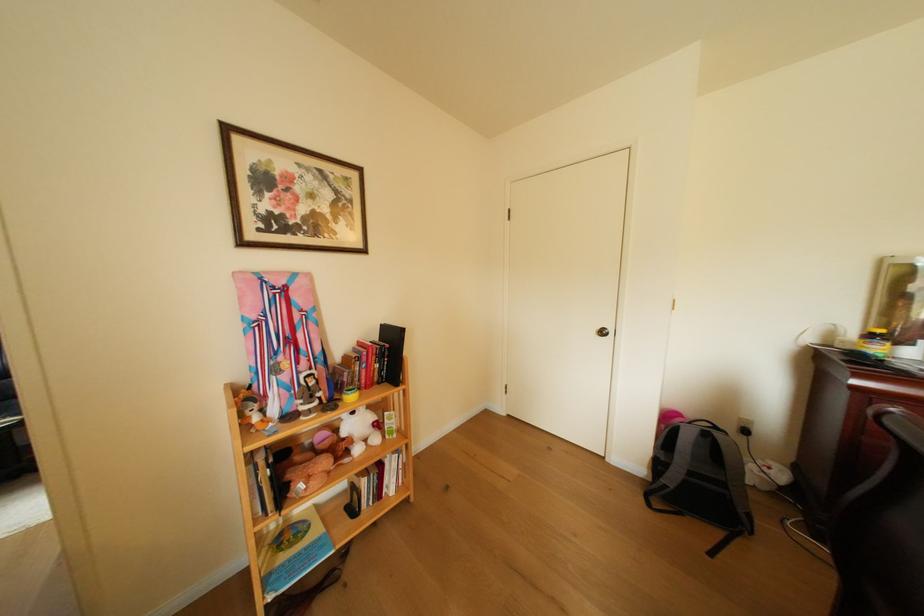
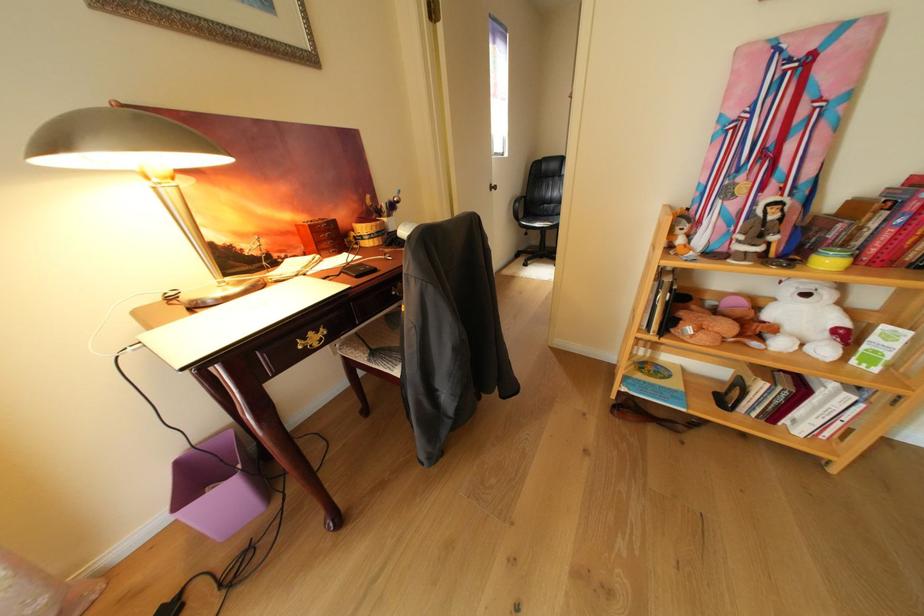
Where in the second image is the point corresponding to (x=367, y=415) from the first image?

(820, 297)